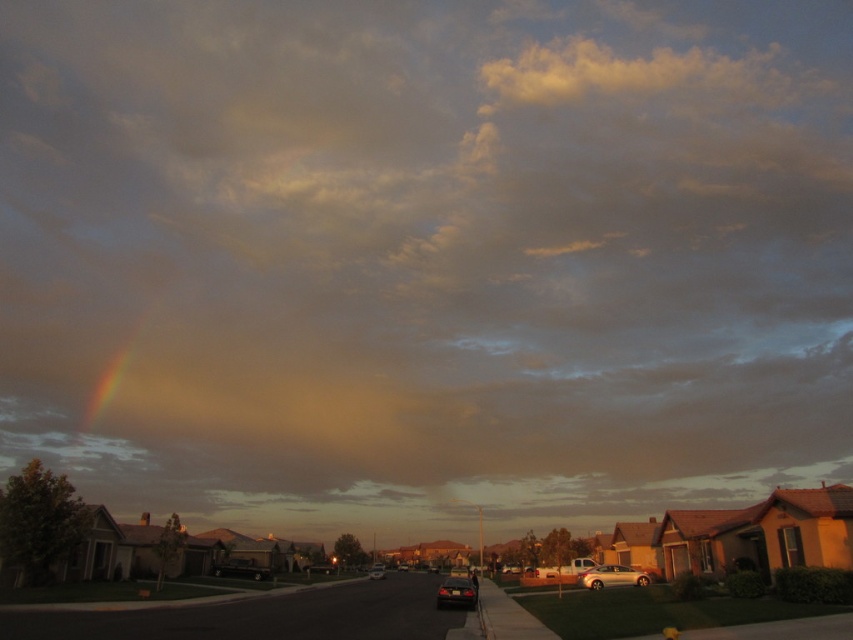
Question: Does satin silver sedan at center appear on the left side of shiny black sedan at lower center?

Choices:
 (A) yes
 (B) no

Answer: (B)

Question: Considering the real-world distances, which object is farthest from the shiny black sedan at lower center?

Choices:
 (A) metallic silver sedan at center
 (B) shiny black sedan at center

Answer: (B)

Question: Is shiny black sedan at lower center thinner than shiny black sedan at center?

Choices:
 (A) yes
 (B) no

Answer: (B)

Question: Estimate the real-world distances between objects in this image. Which object is closer to the satin silver sedan at center?

Choices:
 (A) shiny black sedan at lower center
 (B) shiny black sedan at center

Answer: (A)

Question: Is satin silver sedan at center further to camera compared to shiny black sedan at lower center?

Choices:
 (A) yes
 (B) no

Answer: (A)

Question: Among these points, which one is nearest to the camera?

Choices:
 (A) (380, 564)
 (B) (474, 586)
 (C) (402, 563)

Answer: (B)